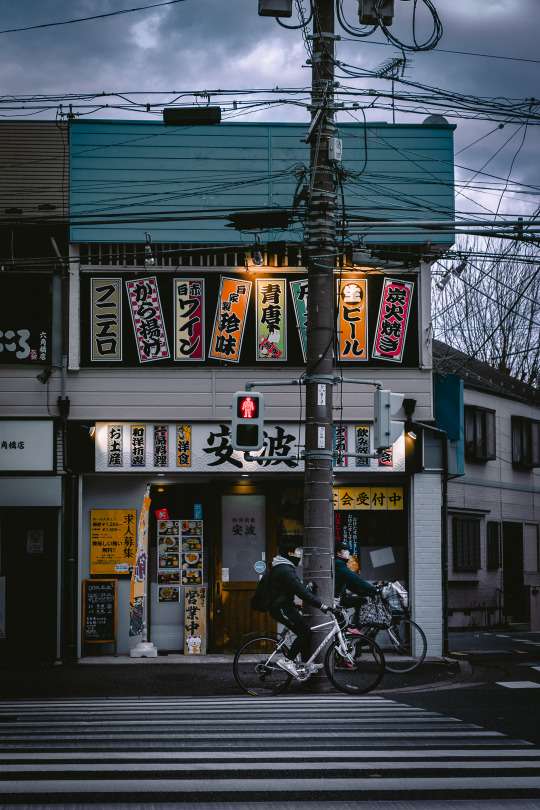
Where is `glass in brown door`? glass in brown door is located at coordinates (243, 544).